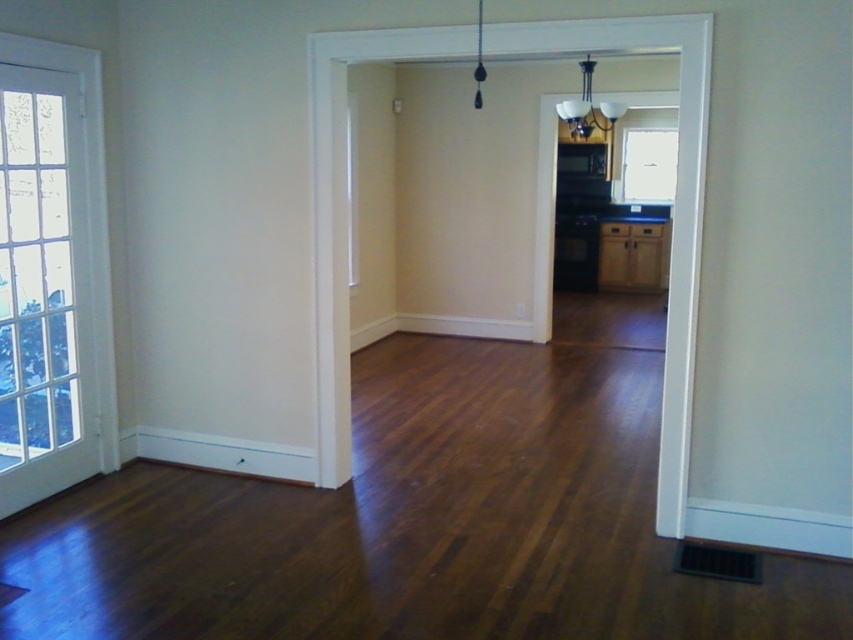
Question: Among these points, which one is nearest to the camera?

Choices:
 (A) (648, 200)
 (B) (70, 115)
 (C) (631, 234)

Answer: (B)

Question: Can you confirm if clear glass door at left is bigger than clear glass window at upper center?

Choices:
 (A) no
 (B) yes

Answer: (B)

Question: Which object is farther from the camera taking this photo?

Choices:
 (A) clear glass window at upper center
 (B) clear glass door at left

Answer: (A)

Question: Is clear glass door at left to the right of clear glass window at upper center from the viewer's perspective?

Choices:
 (A) yes
 (B) no

Answer: (B)

Question: Based on their relative distances, which object is nearer to the clear glass window at upper center?

Choices:
 (A) clear glass door at left
 (B) brown wood cabinet at center

Answer: (B)

Question: Is brown wood cabinet at center further to camera compared to clear glass window at upper center?

Choices:
 (A) yes
 (B) no

Answer: (B)